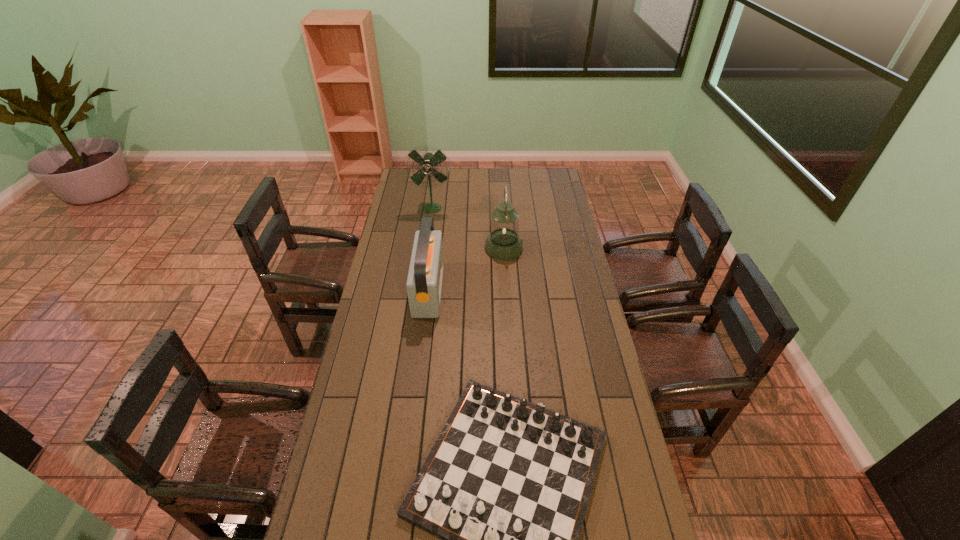
This screenshot has width=960, height=540. Identify the location of vacant space at the right edge of the desktop. (572, 360).

Identify the location of vacant space at the far right corner. (538, 187).

You are a GUI agent. You are given a task and a screenshot of the screen. Output one action in this format:
    pyautogui.click(x=<x>, y=<y>)
    Task: Click on the unoccupied area between the third nearest object and the radio receiver
    The image size is (960, 540).
    Given the screenshot: What is the action you would take?
    pyautogui.click(x=467, y=269)

Identify the location of vacant area between the lantern and the farthest object. Image resolution: width=960 pixels, height=540 pixels. (468, 228).

Where is `vacant space that's between the radio receiver and the lantern`? The width and height of the screenshot is (960, 540). vacant space that's between the radio receiver and the lantern is located at coordinates (467, 269).

What are the coordinates of `vacant space that's between the second farthest object and the radio receiver` in the screenshot? It's located at (467, 269).

Select which object appears as the second closest to the lantern. Please provide its 2D coordinates. Your answer should be formatted as a tuple, i.e. [(x, y)], where the tuple contains the x and y coordinates of a point satisfying the conditions above.

[(426, 164)]

Where is `object that is the second closest to the second nearest object`? Image resolution: width=960 pixels, height=540 pixels. object that is the second closest to the second nearest object is located at coordinates (506, 486).

You are a GUI agent. You are given a task and a screenshot of the screen. Output one action in this format:
    pyautogui.click(x=<x>, y=<y>)
    Task: Click on the free location that satisfies the following two spatial constraints: 1. on the front-facing side of the farthest object; 2. on the right side of the third nearest object
    The image size is (960, 540).
    Given the screenshot: What is the action you would take?
    pyautogui.click(x=426, y=248)

The height and width of the screenshot is (540, 960). In order to click on vacant space that satisfies the following two spatial constraints: 1. on the front-facing side of the tallest object; 2. on the right side of the lantern in this screenshot , I will do `click(426, 248)`.